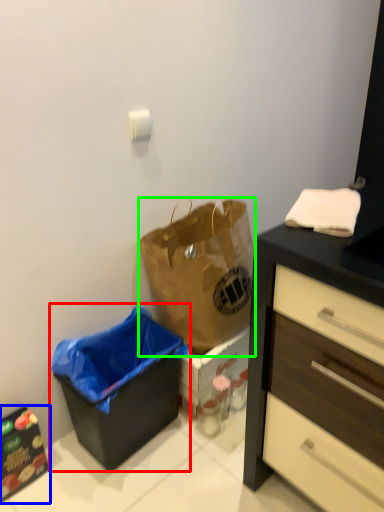
Question: Which object is the farthest from recycling bin (highlighted by a red box)? Choose among these: cabinetry (highlighted by a blue box) or handbag (highlighted by a green box).

Choices:
 (A) cabinetry
 (B) handbag

Answer: (A)